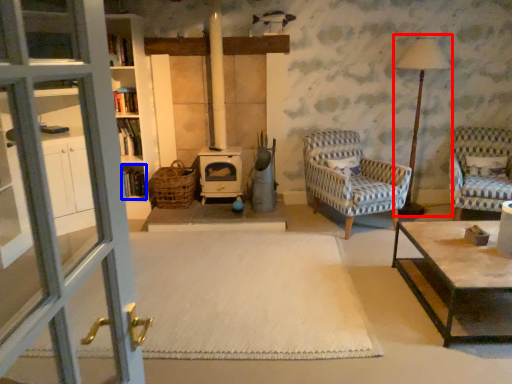
Question: Which point is closer to the camera, table lamp (highlighted by a red box) or shelf (highlighted by a blue box)?

Choices:
 (A) table lamp
 (B) shelf

Answer: (A)